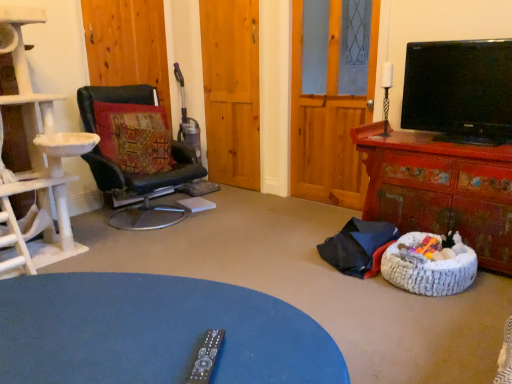
Find the location of a particular element. blank space above black fabric remote control at center (from a real-world perspective) is located at coordinates (135, 312).